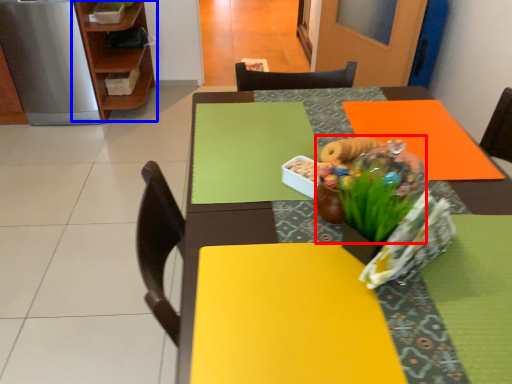
Question: Which object appears closest to the camera in this image, floral arrangement (highlighted by a red box) or shelf (highlighted by a blue box)?

Choices:
 (A) floral arrangement
 (B) shelf

Answer: (A)